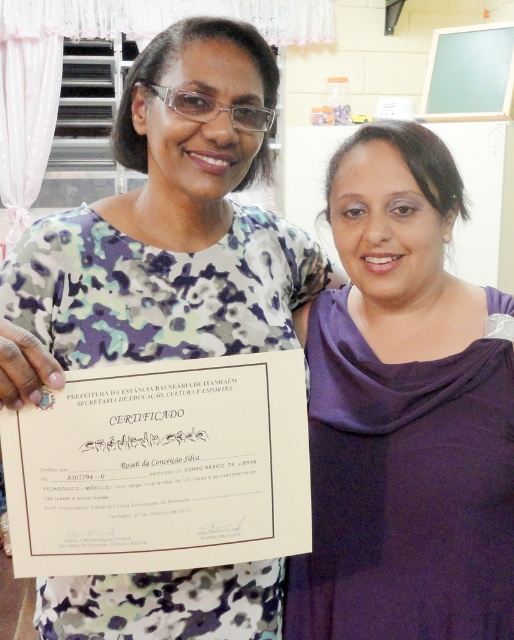
The image size is (514, 640). Describe the element at coordinates (403, 413) in the screenshot. I see `purple matte dress at center` at that location.

Is purple matte dress at center behind white paper certificate at center?

Yes, it is behind white paper certificate at center.

Find the location of a particular element. The width and height of the screenshot is (514, 640). purple matte dress at center is located at coordinates (403, 413).

From the picture: Between camouflage fabric shirt at center and white paper certificate at center, which one appears on the right side from the viewer's perspective?

camouflage fabric shirt at center

Is camouflage fabric shirt at center below white paper certificate at center?

No.

Between point (106, 266) and point (297, 412), which one is positioned in front?

Positioned in front is point (297, 412).

This screenshot has width=514, height=640. I want to click on camouflage fabric shirt at center, so click(173, 220).

Which is below, purple matte dress at center or camouflage fabric shirt at center?

purple matte dress at center is lower down.

Consider the image. Is purple matte dress at center closer to the viewer compared to camouflage fabric shirt at center?

No.

Is point (418, 556) in front of point (34, 230)?

Yes, point (418, 556) is in front of point (34, 230).

Where is `purple matte dress at center`? The height and width of the screenshot is (640, 514). purple matte dress at center is located at coordinates (403, 413).